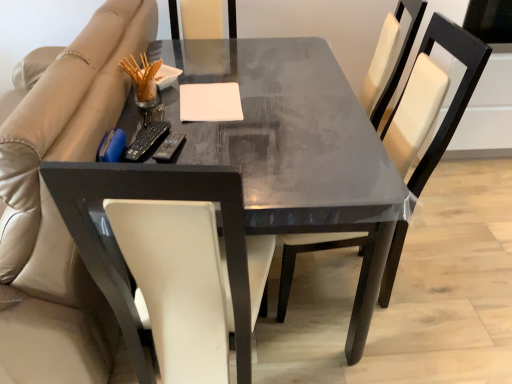
The height and width of the screenshot is (384, 512). In order to click on free space between black plastic remote at left and white matte notepad at center in this screenshot , I will do pos(188,121).